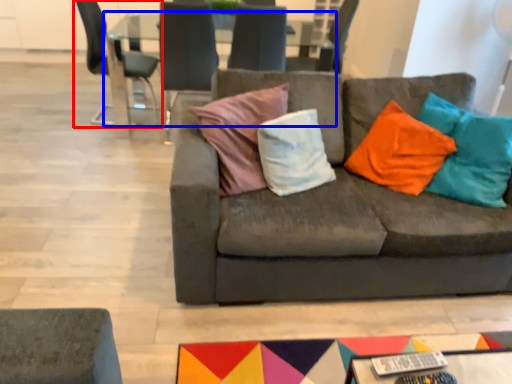
Question: Which point is further to the camera, chair (highlighted by a red box) or table (highlighted by a blue box)?

Choices:
 (A) chair
 (B) table

Answer: (A)